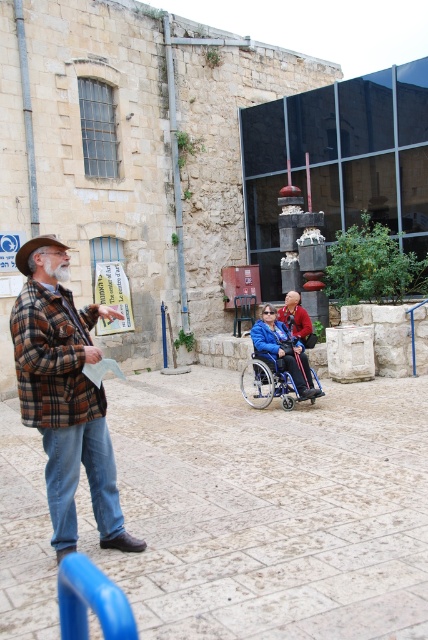
Based on the photo, can you confirm if plaid wool jacket at center is positioned below red fabric jacket at center?

Indeed, plaid wool jacket at center is positioned under red fabric jacket at center.

Does plaid wool jacket at center have a lesser height compared to red fabric jacket at center?

No, plaid wool jacket at center is not shorter than red fabric jacket at center.

Locate an element on the screen. The image size is (428, 640). plaid wool jacket at center is located at coordinates (65, 394).

Is blue plastic wheelchair at center further to the viewer compared to red fabric jacket at center?

No, blue plastic wheelchair at center is closer to the viewer.

Can you confirm if blue plastic wheelchair at center is positioned above red fabric jacket at center?

Incorrect, blue plastic wheelchair at center is not positioned above red fabric jacket at center.

Does point (265, 387) come behind point (305, 326)?

No, it is not.

Find the location of `blue plastic wheelchair at center`. blue plastic wheelchair at center is located at coordinates (276, 378).

Describe the element at coordinates (65, 394) in the screenshot. I see `plaid wool jacket at center` at that location.

What do you see at coordinates (65, 394) in the screenshot?
I see `plaid wool jacket at center` at bounding box center [65, 394].

Locate an element on the screen. plaid wool jacket at center is located at coordinates (65, 394).